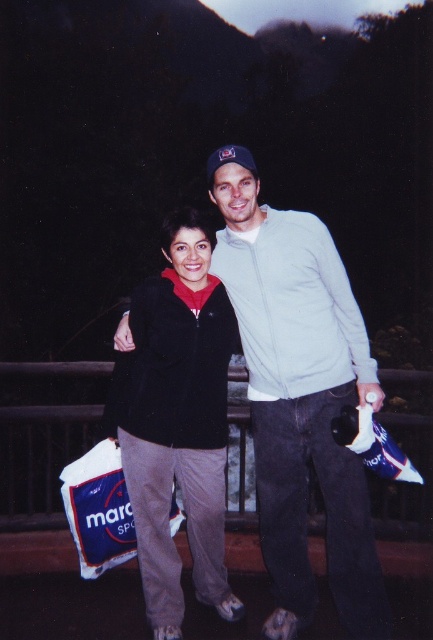
Who is shorter, light gray cotton jacket at center or black fleece jacket at center?

black fleece jacket at center is shorter.

This screenshot has width=433, height=640. What do you see at coordinates (300, 396) in the screenshot? I see `light gray cotton jacket at center` at bounding box center [300, 396].

Find the location of a particular element. This screenshot has width=433, height=640. light gray cotton jacket at center is located at coordinates (300, 396).